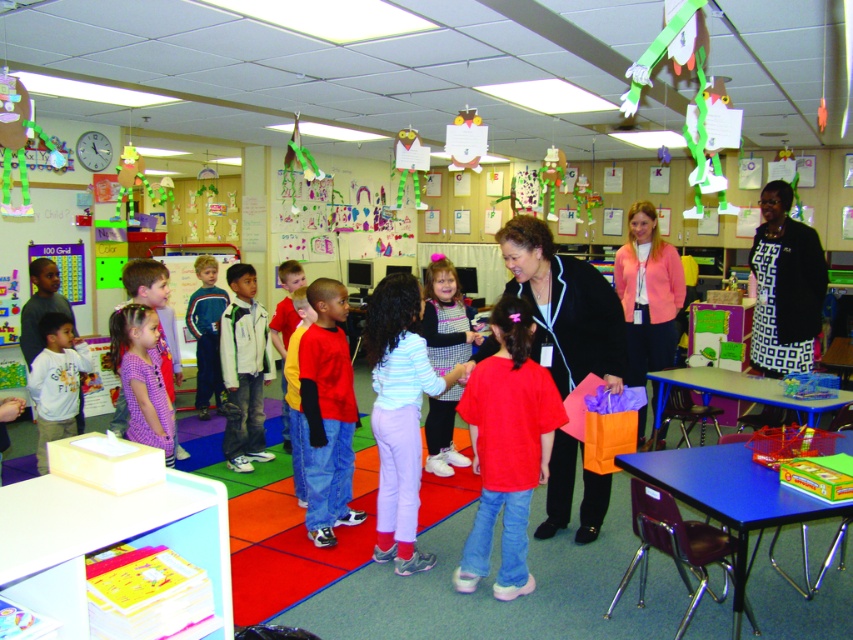
Question: Which of the following is the farthest from the observer?

Choices:
 (A) (450, 298)
 (B) (541, 458)
 (C) (244, 353)

Answer: (C)

Question: Among these objects, which one is nearest to the camera?

Choices:
 (A) green fleece jacket at center
 (B) matte gray shirt at left

Answer: (B)

Question: Is striped cotton shirt at center above green and white jacket at center?

Choices:
 (A) no
 (B) yes

Answer: (A)

Question: In this image, where is red/yellow long-sleeve shirt at center located relative to green and white jacket at center?

Choices:
 (A) right
 (B) left

Answer: (A)

Question: Which point appears closest to the camera in this image?

Choices:
 (A) (410, 339)
 (B) (503, 417)

Answer: (B)

Question: Does green and white jacket at center have a larger size compared to yellow fleece sweater at center?

Choices:
 (A) no
 (B) yes

Answer: (A)